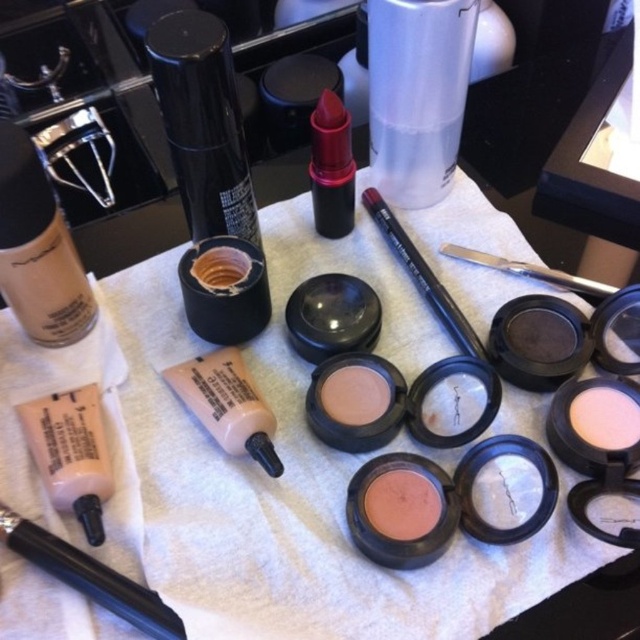
Does matte cream foundation at upper left have a smaller size compared to translucent matte liquid foundation at lower left?

Actually, matte cream foundation at upper left might be larger than translucent matte liquid foundation at lower left.

Who is more forward, (8,212) or (68,419)?

Positioned in front is point (8,212).

Who is more forward, (42, 236) or (102, 454)?

Positioned in front is point (42, 236).

Find the location of a particular element. Image resolution: width=640 pixels, height=640 pixels. matte cream foundation at upper left is located at coordinates (38, 250).

Is point (84, 385) closer to viewer compared to point (611, 424)?

That is False.

Can you confirm if translucent matte liquid foundation at lower left is bigger than matte white powder at center?

Correct, translucent matte liquid foundation at lower left is larger in size than matte white powder at center.

Is point (113, 480) in front of point (605, 385)?

That is True.

This screenshot has width=640, height=640. In order to click on translucent matte liquid foundation at lower left in this screenshot , I will do `click(72, 452)`.

Which is more to the left, matte brown powder at center or matte cream eyeshadow at center?

matte cream eyeshadow at center

Which is in front, point (557, 323) or point (433, 419)?

Point (433, 419)

Is point (561, 346) closer to viewer compared to point (458, 385)?

Yes, it is in front of point (458, 385).

Where is `matte brown powder at center`? matte brown powder at center is located at coordinates (540, 333).